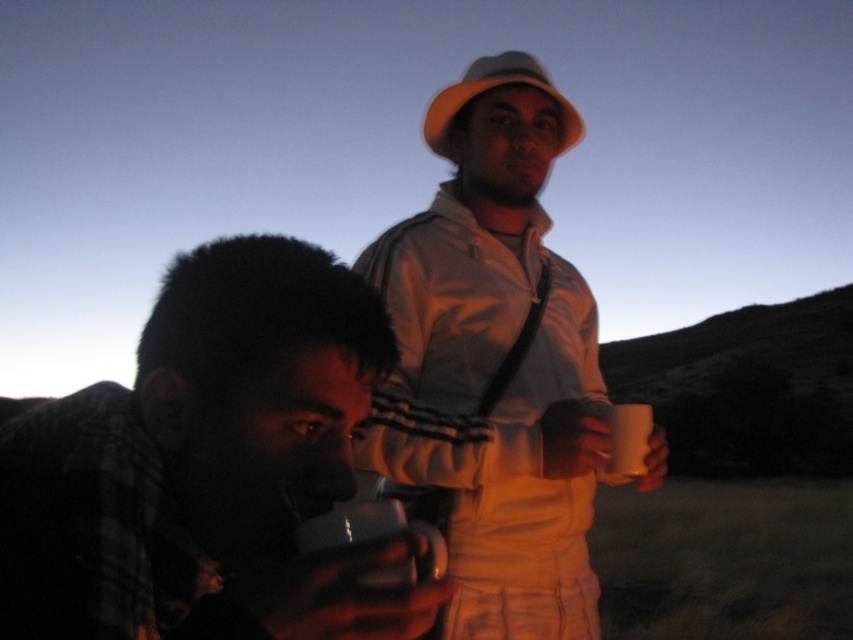
You are a delivery robot with a 50 cm arm reach. You need to pick up both the matte black mug at lower left and the white matte mug at upper center from the table. Can your arm reach both mugs?

The matte black mug at lower left is 95.59 centimeters away from the white matte mug at upper center. Since the distance between them is greater than your 50 cm arm reach, you cannot reach both mugs at the same time.

Based on the scene description, which mug is more likely to have a larger capacity, the matte black mug at lower left or the white matte mug at upper center?

The matte black mug at lower left might be wider than the white matte mug at upper center, so it could have a larger capacity.

You are a photographer trying to capture a closeup of the white matte jacket at center. Based on the scene, can you determine if you can focus on the jacket clearly from your current position?

The white matte jacket at center is 36.37 inches away from the camera, so yes, you can focus on it clearly from your current position since it is within the camera focus range.